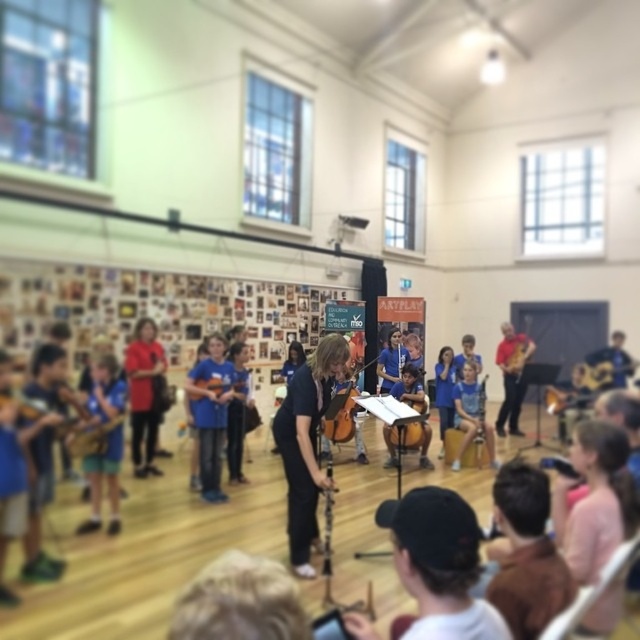
Question: Where is wooden polished cello at center located in relation to wooden cello at center in the image?

Choices:
 (A) above
 (B) below

Answer: (A)

Question: Can you confirm if matte brown violin at center is positioned to the left of wooden cello at center?

Choices:
 (A) yes
 (B) no

Answer: (A)

Question: Which point is farther to the camera?

Choices:
 (A) (417, 388)
 (B) (476, 406)
 (C) (356, 372)
 (D) (278, 444)

Answer: (C)

Question: Among these points, which one is nearest to the camera?

Choices:
 (A) (301, 369)
 (B) (342, 336)

Answer: (A)

Question: Can you confirm if wooden polished cello at center is smaller than wooden cello at center?

Choices:
 (A) yes
 (B) no

Answer: (B)

Question: Which object is closer to the camera taking this photo?

Choices:
 (A) light brown wooden chair at center
 (B) black matte clarinet at center
 (C) wooden polished cello at center
 (D) wooden cello at center

Answer: (B)